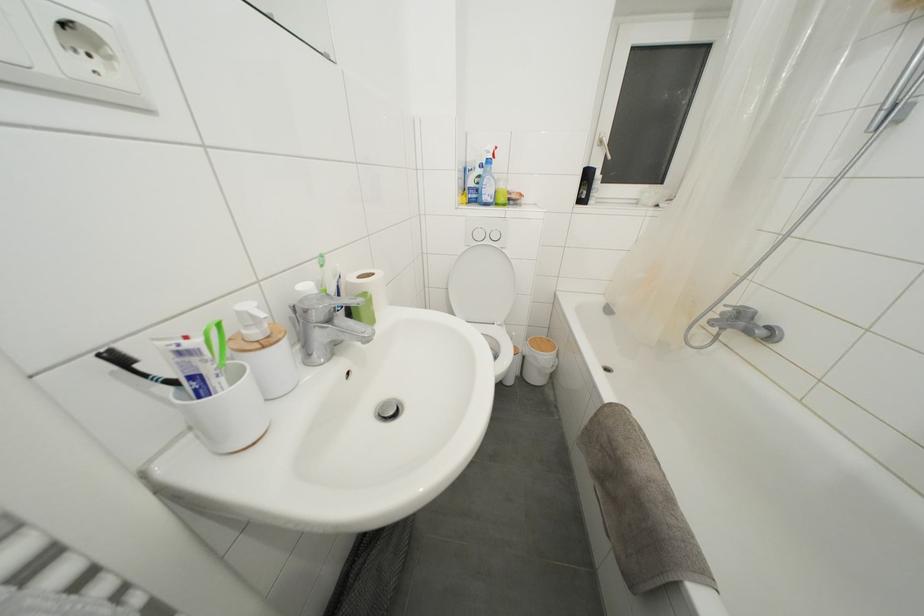
Identify the location of silver shower handle. (737, 313).